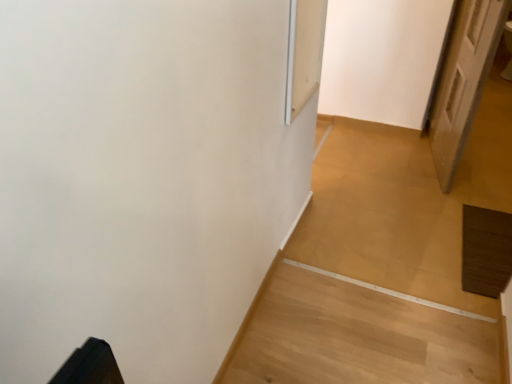
Question: In terms of size, does white wooden door at right appear bigger or smaller than transparent glass screen door at upper center?

Choices:
 (A) small
 (B) big

Answer: (B)

Question: Looking at their shapes, would you say white wooden door at right is wider or thinner than transparent glass screen door at upper center?

Choices:
 (A) thin
 (B) wide

Answer: (B)

Question: In the image, is white wooden door at right on the left side or the right side of transparent glass screen door at upper center?

Choices:
 (A) left
 (B) right

Answer: (B)

Question: Considering the positions of point (295, 76) and point (448, 66), is point (295, 76) closer or farther from the camera than point (448, 66)?

Choices:
 (A) farther
 (B) closer

Answer: (B)

Question: From a real-world perspective, is transparent glass screen door at upper center positioned above or below white wooden door at right?

Choices:
 (A) below
 (B) above

Answer: (B)

Question: In terms of width, does transparent glass screen door at upper center look wider or thinner when compared to white wooden door at right?

Choices:
 (A) thin
 (B) wide

Answer: (A)

Question: From the image's perspective, relative to white wooden door at right, is transparent glass screen door at upper center above or below?

Choices:
 (A) below
 (B) above

Answer: (A)